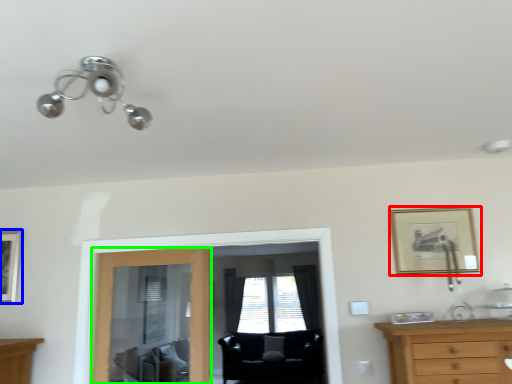
Question: Which object is the closest to the picture frame (highlighted by a red box)? Choose among these: picture frame (highlighted by a blue box) or door (highlighted by a green box).

Choices:
 (A) picture frame
 (B) door

Answer: (B)